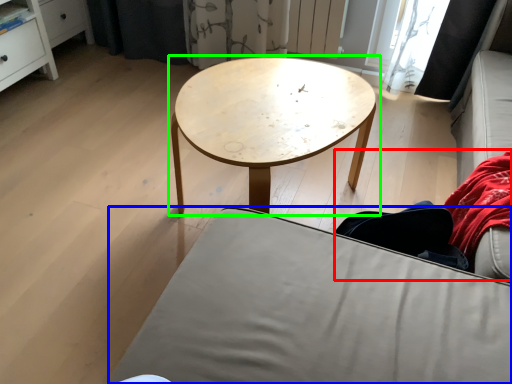
Question: Which object is positioned farthest from couple (highlighted by a red box)? Select from studio couch (highlighted by a blue box) and coffee table (highlighted by a green box).

Choices:
 (A) studio couch
 (B) coffee table

Answer: (B)